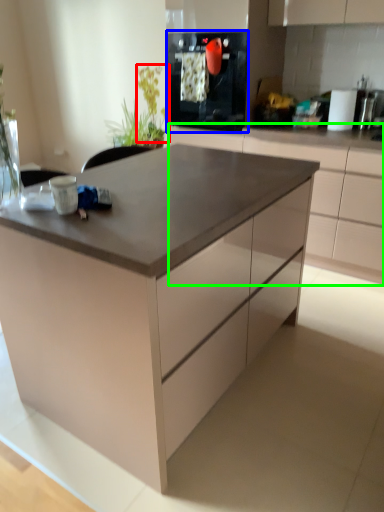
Question: Considering the real-world distances, which object is closest to plant (highlighted by a red box)? kitchen appliance (highlighted by a blue box) or cabinetry (highlighted by a green box).

Choices:
 (A) kitchen appliance
 (B) cabinetry

Answer: (A)